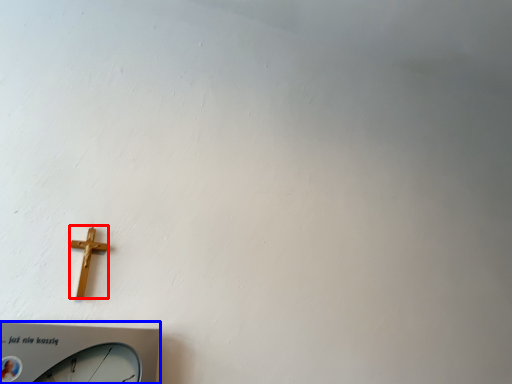
Question: Which point is closer to the camera, crucifix (highlighted by a red box) or wall clock (highlighted by a blue box)?

Choices:
 (A) crucifix
 (B) wall clock

Answer: (B)